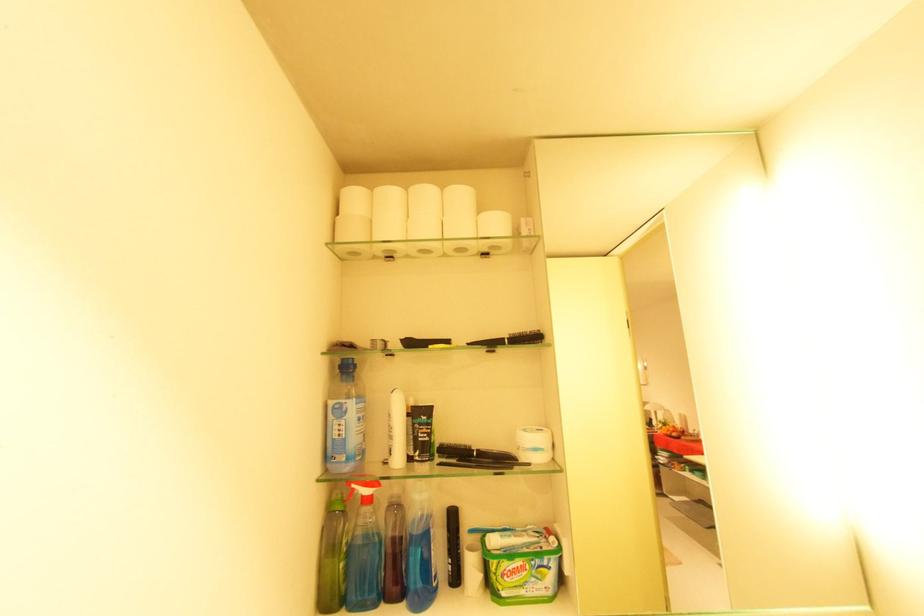
The image size is (924, 616). What do you see at coordinates (359, 498) in the screenshot?
I see `a red spray trigger` at bounding box center [359, 498].